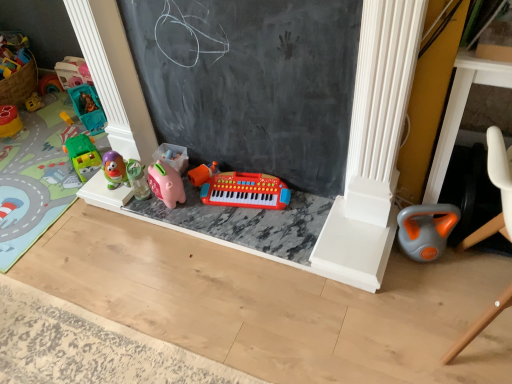
The height and width of the screenshot is (384, 512). What are the coordinates of `vacant area that lies between teal plastic toy truck at left, the sixth toy when ordered from right to left, and rubberized green car at left, which ranks as the first toy in left-to-right order` in the screenshot? It's located at (40, 123).